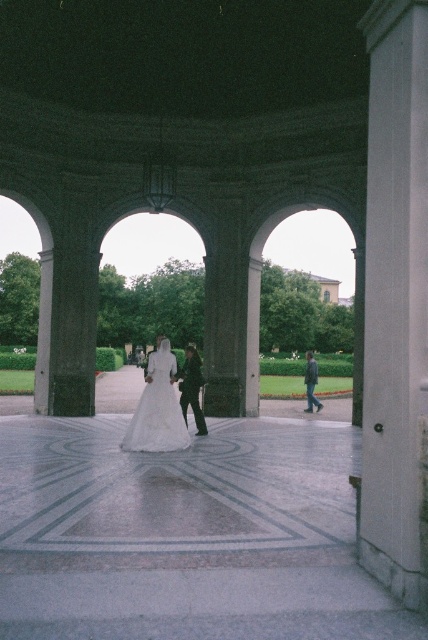
Question: Which of the following is the farthest from the observer?

Choices:
 (A) (163, 365)
 (B) (306, 376)
 (C) (198, 372)

Answer: (B)

Question: Which point is farther from the camera taking this photo?

Choices:
 (A) (169, 352)
 (B) (309, 388)
 (C) (392, 4)

Answer: (B)

Question: Which point is closer to the camera taking this photo?

Choices:
 (A) (380, 337)
 (B) (145, 394)
 (C) (306, 380)
 (D) (195, 356)

Answer: (A)

Question: Does white smooth pillar at right have a lesser width compared to dark green fabric jacket at center?

Choices:
 (A) yes
 (B) no

Answer: (A)

Question: Does dark green fabric jacket at center have a larger size compared to dark green jacket at center?

Choices:
 (A) yes
 (B) no

Answer: (B)

Question: Is white satin dress at center above dark green fabric jacket at center?

Choices:
 (A) no
 (B) yes

Answer: (B)